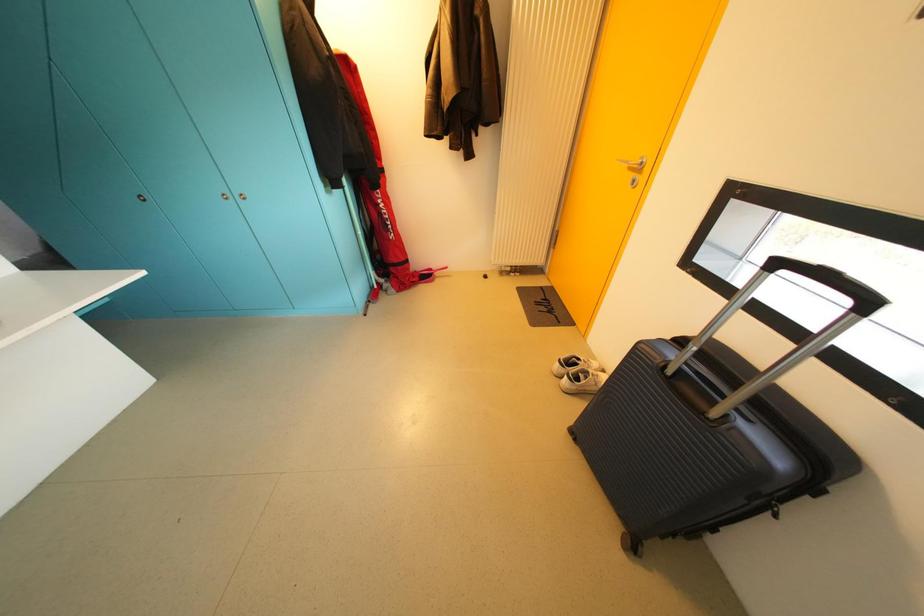
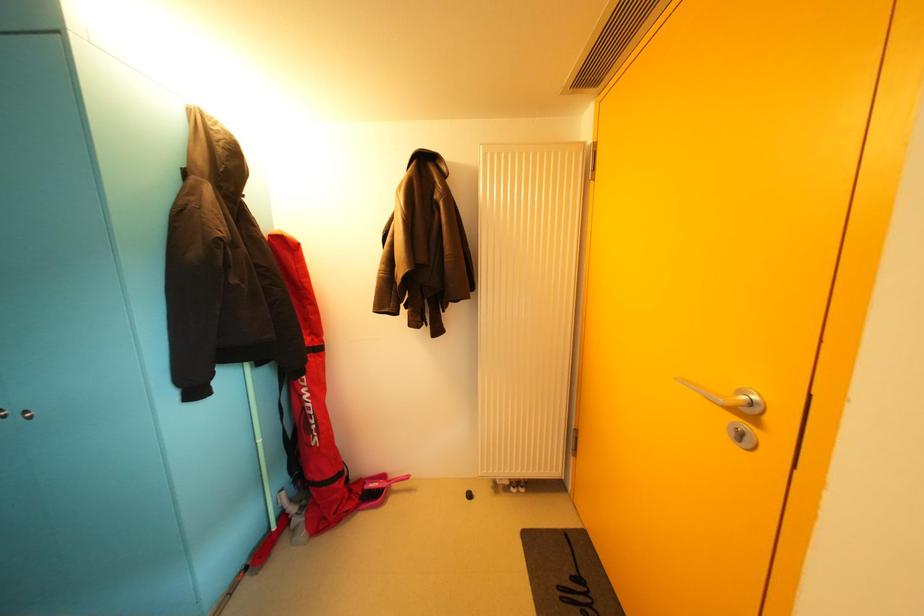
Question: How did the camera likely rotate?

Choices:
 (A) Left
 (B) Right
 (C) Up
 (D) Down

Answer: (C)